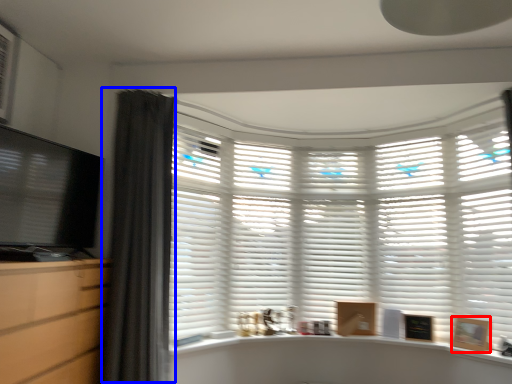
Question: Among these objects, which one is farthest to the camera, picture frame (highlighted by a red box) or curtain (highlighted by a blue box)?

Choices:
 (A) picture frame
 (B) curtain

Answer: (A)